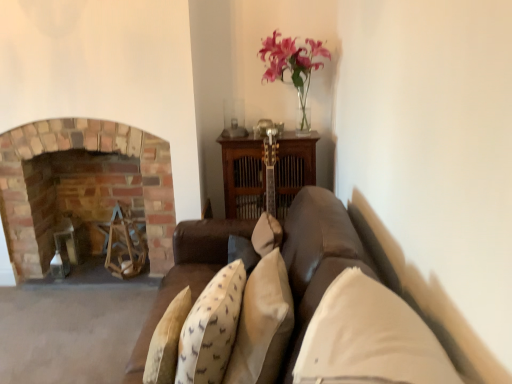
This screenshot has width=512, height=384. What do you see at coordinates (53, 190) in the screenshot?
I see `brick fireplace at left` at bounding box center [53, 190].

Find the location of a particular element. The height and width of the screenshot is (384, 512). beige fabric pillow at center, the 2th pillow from the right is located at coordinates (262, 324).

Locate an element on the screen. white fabric pillow at center, which is the second pillow in left-to-right order is located at coordinates (369, 338).

Is brick fireplace at left not within beige fabric pillow at center, the 2th pillow from the right?

brick fireplace at left lies outside beige fabric pillow at center, the 2th pillow from the right,'s area.

Does brick fireplace at left have a larger size compared to beige fabric pillow at center, the 2th pillow from the right?

Correct, brick fireplace at left is larger in size than beige fabric pillow at center, the 2th pillow from the right.

From a real-world perspective, is brick fireplace at left physically located above or below beige fabric pillow at center, placed as the 1th pillow when sorted from left to right?

brick fireplace at left is situated lower than beige fabric pillow at center, placed as the 1th pillow when sorted from left to right, in the real world.

From a real-world perspective, who is located lower, white fabric pillow at center, which ranks as the first pillow in right-to-left order, or brick fireplace at left?

In real-world perspective, brick fireplace at left is lower.

Is white fabric pillow at center, which is the second pillow in left-to-right order, smaller than brick fireplace at left?

Correct, white fabric pillow at center, which is the second pillow in left-to-right order, occupies less space than brick fireplace at left.

I want to click on fireplace located above the white fabric pillow at center, which is the second pillow in left-to-right order (from the image's perspective), so click(53, 190).

Is beige fabric pillow at center, placed as the 1th pillow when sorted from left to right, to the right of brick fireplace at left from the viewer's perspective?

Yes, beige fabric pillow at center, placed as the 1th pillow when sorted from left to right, is to the right of brick fireplace at left.

Considering the positions of objects beige fabric pillow at center, the 2th pillow from the right, and brick fireplace at left in the image provided, who is behind, beige fabric pillow at center, the 2th pillow from the right, or brick fireplace at left?

brick fireplace at left is further from the camera.

Does beige fabric pillow at center, the 2th pillow from the right, touch brick fireplace at left?

No, beige fabric pillow at center, the 2th pillow from the right, is not in contact with brick fireplace at left.

Is beige fabric pillow at center, the 2th pillow from the right, inside the boundaries of brick fireplace at left, or outside?

beige fabric pillow at center, the 2th pillow from the right, is located beyond the bounds of brick fireplace at left.

How many degrees apart are the facing directions of brick fireplace at left and white fabric pillow at center, which ranks as the first pillow in right-to-left order?

There is a 87.7-degree angle between the facing directions of brick fireplace at left and white fabric pillow at center, which ranks as the first pillow in right-to-left order.

Is point (110, 137) farther from camera compared to point (391, 315)?

That is True.

Could you tell me if brick fireplace at left is turned towards white fabric pillow at center, which ranks as the first pillow in right-to-left order?

No, brick fireplace at left is not turned towards white fabric pillow at center, which ranks as the first pillow in right-to-left order.

Consider the image. Is the surface of brick fireplace at left in direct contact with white fabric pillow at center, which ranks as the first pillow in right-to-left order?

No.

Could you measure the distance between beige fabric pillow at center, the 2th pillow from the right, and white fabric pillow at center, which is the second pillow in left-to-right order?

beige fabric pillow at center, the 2th pillow from the right, and white fabric pillow at center, which is the second pillow in left-to-right order, are 12.92 inches apart.

Would you consider beige fabric pillow at center, the 2th pillow from the right, to be distant from white fabric pillow at center, which is the second pillow in left-to-right order?

No, beige fabric pillow at center, the 2th pillow from the right, is not far away from white fabric pillow at center, which is the second pillow in left-to-right order.

Where is `pillow located in front of the beige fabric pillow at center, the 2th pillow from the right`? The image size is (512, 384). pillow located in front of the beige fabric pillow at center, the 2th pillow from the right is located at coordinates (369, 338).

From a real-world perspective, is beige fabric pillow at center, placed as the 1th pillow when sorted from left to right, above or below white fabric pillow at center, which is the second pillow in left-to-right order?

beige fabric pillow at center, placed as the 1th pillow when sorted from left to right, is below white fabric pillow at center, which is the second pillow in left-to-right order.

From the image's perspective, relative to beige fabric pillow at center, the 2th pillow from the right, is white fabric pillow at center, which is the second pillow in left-to-right order, above or below?

Clearly, from the image's perspective, white fabric pillow at center, which is the second pillow in left-to-right order, is above beige fabric pillow at center, the 2th pillow from the right.

Is white fabric pillow at center, which ranks as the first pillow in right-to-left order, looking in the opposite direction of beige fabric pillow at center, the 2th pillow from the right?

No, beige fabric pillow at center, the 2th pillow from the right, is not at the back of white fabric pillow at center, which ranks as the first pillow in right-to-left order.

Which object is further away from the camera taking this photo, white fabric pillow at center, which ranks as the first pillow in right-to-left order, or beige fabric pillow at center, placed as the 1th pillow when sorted from left to right?

beige fabric pillow at center, placed as the 1th pillow when sorted from left to right.

You are a GUI agent. You are given a task and a screenshot of the screen. Output one action in this format:
    pyautogui.click(x=<x>, y=<y>)
    Task: Click on the fireplace on the left of beige fabric pillow at center, the 2th pillow from the right
    Image resolution: width=512 pixels, height=384 pixels.
    Given the screenshot: What is the action you would take?
    pyautogui.click(x=53, y=190)

I want to click on the 2nd pillow located above the brick fireplace at left (from a real-world perspective), so click(369, 338).

From the image, which object appears to be nearer to beige fabric pillow at center, placed as the 1th pillow when sorted from left to right, brick fireplace at left or white fabric pillow at center, which is the second pillow in left-to-right order?

white fabric pillow at center, which is the second pillow in left-to-right order, is positioned closer to the anchor beige fabric pillow at center, placed as the 1th pillow when sorted from left to right.

Consider the image. Considering their positions, is beige fabric pillow at center, placed as the 1th pillow when sorted from left to right, positioned further to white fabric pillow at center, which ranks as the first pillow in right-to-left order, than brick fireplace at left?

brick fireplace at left is further to white fabric pillow at center, which ranks as the first pillow in right-to-left order.

Considering their positions, is beige fabric pillow at center, placed as the 1th pillow when sorted from left to right, positioned further to brick fireplace at left than white fabric pillow at center, which ranks as the first pillow in right-to-left order?

white fabric pillow at center, which ranks as the first pillow in right-to-left order, lies further to brick fireplace at left than the other object.

Looking at the image, which one is located further to brick fireplace at left, white fabric pillow at center, which ranks as the first pillow in right-to-left order, or beige fabric pillow at center, placed as the 1th pillow when sorted from left to right?

white fabric pillow at center, which ranks as the first pillow in right-to-left order, is further to brick fireplace at left.

When comparing their distances from beige fabric pillow at center, the 2th pillow from the right, does white fabric pillow at center, which ranks as the first pillow in right-to-left order, or brick fireplace at left seem further?

brick fireplace at left is positioned further to the anchor beige fabric pillow at center, the 2th pillow from the right.

Which object lies nearer to the anchor point white fabric pillow at center, which is the second pillow in left-to-right order, brick fireplace at left or beige fabric pillow at center, the 2th pillow from the right?

beige fabric pillow at center, the 2th pillow from the right, lies closer to white fabric pillow at center, which is the second pillow in left-to-right order, than the other object.

Find the location of a particular element. This screenshot has height=384, width=512. pillow positioned between white fabric pillow at center, which ranks as the first pillow in right-to-left order, and brick fireplace at left from near to far is located at coordinates (262, 324).